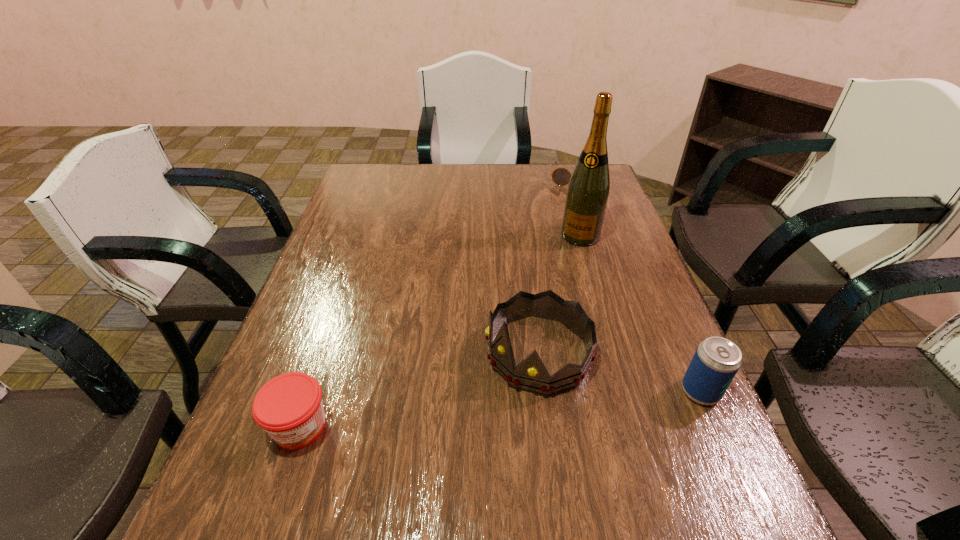
Identify the location of free space on the desktop that is between the leftmost object and the third tallest object and is positioned on the front-facing side of the tallest object. (502, 409).

This screenshot has height=540, width=960. I want to click on vacant space on the desktop that is between the leftmost object and the beer can and is positioned on the lenses of the sunglasses, so point(511,408).

Where is `free space on the desktop that is between the fourth tallest object and the third shortest object and is positioned at the front of the tiara with jewels`? The image size is (960, 540). free space on the desktop that is between the fourth tallest object and the third shortest object and is positioned at the front of the tiara with jewels is located at coordinates (448, 414).